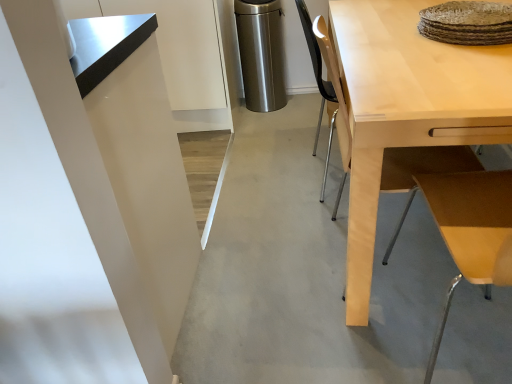
This screenshot has height=384, width=512. What are the coordinates of `light wood table at upper right` in the screenshot? It's located at (468, 231).

What is the approximate height of light wood desk at right?

The height of light wood desk at right is 72.86 centimeters.

The image size is (512, 384). What are the coordinates of `stainless steel trash can at center` in the screenshot? It's located at (261, 53).

At what (x,y) coordinates should I click in order to perform the action: click on light wood table at upper right. Please return your answer as a coordinate pair (x, y). The width and height of the screenshot is (512, 384). Looking at the image, I should click on (468, 231).

Is the depth of stainless steel trash can at center less than that of light wood desk at right?

No, stainless steel trash can at center is behind light wood desk at right.

Which is closer, (268, 50) or (483, 67)?

The point (483, 67) is closer to the camera.

Considering the sizes of stainless steel trash can at center and light wood desk at right in the image, is stainless steel trash can at center bigger or smaller than light wood desk at right?

Clearly, stainless steel trash can at center is smaller in size than light wood desk at right.

From the image's perspective, would you say stainless steel trash can at center is positioned over light wood desk at right?

Yes.

Is light wood table at upper right turned away from light wood desk at right?

light wood table at upper right does not have its back to light wood desk at right.

Measure the distance between light wood table at upper right and light wood desk at right.

The distance of light wood table at upper right from light wood desk at right is 14.65 inches.

Who is smaller, light wood table at upper right or light wood desk at right?

light wood table at upper right.

Considering their positions, is light wood table at upper right located in front of or behind light wood desk at right?

Clearly, light wood table at upper right is in front of light wood desk at right.

Is stainless steel trash can at center wider or thinner than light wood table at upper right?

In the image, stainless steel trash can at center appears to be more narrow than light wood table at upper right.

From the image's perspective, who appears lower, stainless steel trash can at center or light wood table at upper right?

From the image's view, light wood table at upper right is below.

Is stainless steel trash can at center turned away from light wood table at upper right?

stainless steel trash can at center does not have its back to light wood table at upper right.

Looking at this image, is stainless steel trash can at center touching light wood table at upper right?

stainless steel trash can at center and light wood table at upper right are not in contact.

From a real-world perspective, between light wood desk at right and light wood table at upper right, who is vertically higher?

light wood table at upper right, from a real-world perspective.

Would you say light wood desk at right is outside light wood table at upper right?

light wood desk at right is positioned outside light wood table at upper right.

Is light wood desk at right looking in the opposite direction of light wood table at upper right?

light wood desk at right is not turned away from light wood table at upper right.

Which of these two, light wood desk at right or light wood table at upper right, is wider?

light wood desk at right is wider.

Between light wood table at upper right and stainless steel trash can at center, which one appears on the right side from the viewer's perspective?

light wood table at upper right is more to the right.

Is light wood table at upper right facing towards stainless steel trash can at center?

No.

Is point (490, 239) closer to camera compared to point (282, 85)?

Yes, point (490, 239) is closer to viewer.

You are a GUI agent. You are given a task and a screenshot of the screen. Output one action in this format:
    pyautogui.click(x=<x>, y=<y>)
    Task: Click on the appliance located above the light wood table at upper right (from the image's perspective)
    
    Given the screenshot: What is the action you would take?
    pyautogui.click(x=261, y=53)

Are light wood desk at right and stainless steel trash can at center beside each other?

No.

Is stainless steel trash can at center at the back of light wood desk at right?

No, light wood desk at right is not facing away from stainless steel trash can at center.

Can stainless steel trash can at center be found inside light wood desk at right?

No.

Is light wood desk at right thinner than stainless steel trash can at center?

No, light wood desk at right is not thinner than stainless steel trash can at center.

I want to click on desk located in front of the stainless steel trash can at center, so click(x=407, y=108).

The height and width of the screenshot is (384, 512). Find the location of `table that is on the left side of light wood desk at right`. table that is on the left side of light wood desk at right is located at coordinates (468, 231).

Looking at the image, which one is located closer to light wood desk at right, stainless steel trash can at center or light wood table at upper right?

light wood table at upper right is positioned closer to the anchor light wood desk at right.

Considering their positions, is light wood table at upper right positioned further to stainless steel trash can at center than light wood desk at right?

light wood table at upper right lies further to stainless steel trash can at center than the other object.

When comparing their distances from stainless steel trash can at center, does light wood desk at right or light wood table at upper right seem further?

light wood table at upper right lies further to stainless steel trash can at center than the other object.

Considering their positions, is light wood table at upper right positioned further to light wood desk at right than stainless steel trash can at center?

stainless steel trash can at center.

Based on their spatial positions, is light wood desk at right or stainless steel trash can at center closer to light wood table at upper right?

A: Based on the image, light wood desk at right appears to be nearer to light wood table at upper right.

In the scene shown: When comparing their distances from light wood table at upper right, does stainless steel trash can at center or light wood desk at right seem further?

stainless steel trash can at center is further to light wood table at upper right.

You are a GUI agent. You are given a task and a screenshot of the screen. Output one action in this format:
    pyautogui.click(x=<x>, y=<y>)
    Task: Click on the desk positioned between light wood table at upper right and stainless steel trash can at center from near to far
    This screenshot has width=512, height=384.
    Given the screenshot: What is the action you would take?
    pyautogui.click(x=407, y=108)